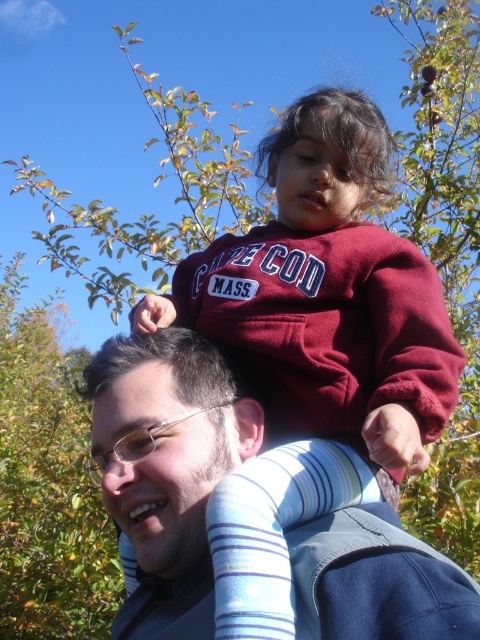
Can you confirm if maroon fleece at upper center is shorter than matte blue shirt at upper center?

Incorrect, maroon fleece at upper center's height does not fall short of matte blue shirt at upper center's.

Which of these two, maroon fleece at upper center or matte blue shirt at upper center, stands taller?

maroon fleece at upper center

Between point (376, 429) and point (170, 378), which one is positioned behind?

The point (170, 378) is more distant.

Find the location of `maroon fleece at upper center`. maroon fleece at upper center is located at coordinates [x=327, y=294].